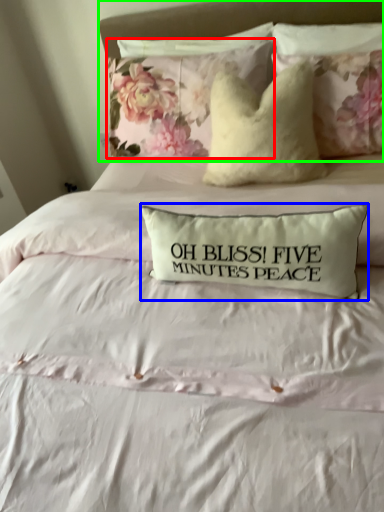
Question: Based on their relative distances, which object is farther from pillow (highlighted by a red box)? Choose from pillow (highlighted by a blue box) and headboard (highlighted by a green box).

Choices:
 (A) pillow
 (B) headboard

Answer: (A)